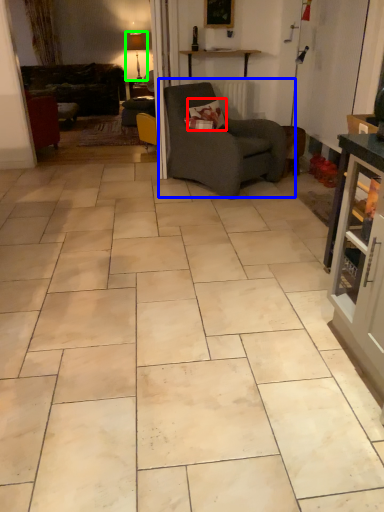
Question: Estimate the real-world distances between objects in this image. Which object is farther from pillow (highlighted by a red box), chair (highlighted by a blue box) or lamp (highlighted by a green box)?

Choices:
 (A) chair
 (B) lamp

Answer: (B)